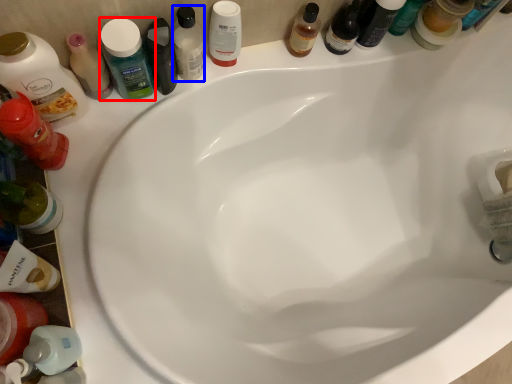
Question: Among these objects, which one is nearest to the camera, mouthwash (highlighted by a red box) or mouthwash (highlighted by a blue box)?

Choices:
 (A) mouthwash
 (B) mouthwash

Answer: (A)